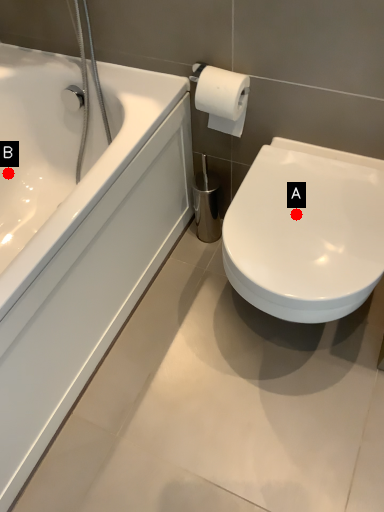
Question: Two points are circled on the image, labeled by A and B beside each circle. Among these points, which one is nearest to the camera?

Choices:
 (A) A is closer
 (B) B is closer

Answer: (A)